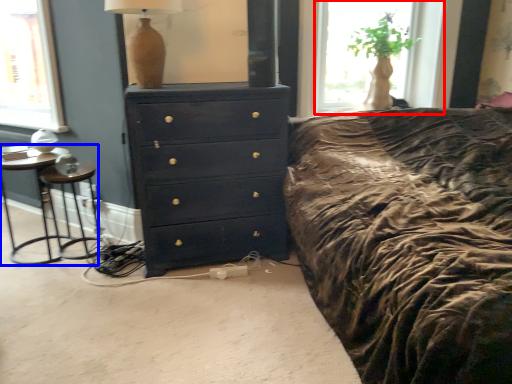
Question: Which object is further to the camera taking this photo, window (highlighted by a red box) or nightstand (highlighted by a blue box)?

Choices:
 (A) window
 (B) nightstand

Answer: (A)